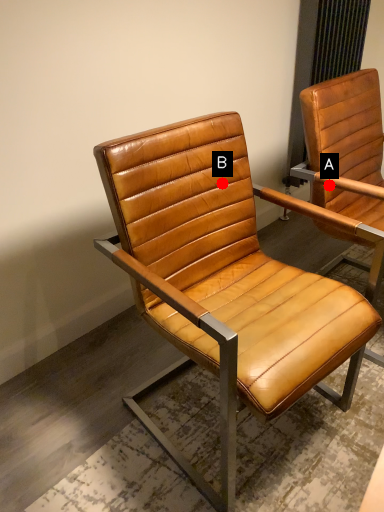
Question: Two points are circled on the image, labeled by A and B beside each circle. Which point is closer to the camera?

Choices:
 (A) A is closer
 (B) B is closer

Answer: (B)